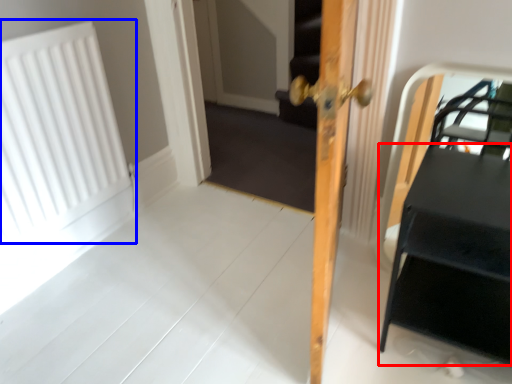
Question: Which object is further to the camera taking this photo, table (highlighted by a red box) or radiator (highlighted by a blue box)?

Choices:
 (A) table
 (B) radiator

Answer: (B)